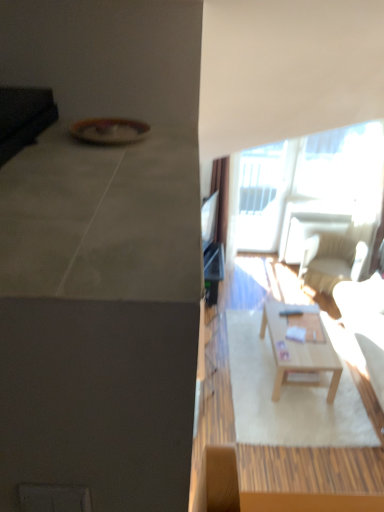
Question: Is matte black tv at upper right wider or thinner than white leather couch at right?

Choices:
 (A) wide
 (B) thin

Answer: (B)

Question: Considering their positions, is matte black tv at upper right located in front of or behind white leather couch at right?

Choices:
 (A) behind
 (B) front

Answer: (A)

Question: Estimate the real-world distances between objects in this image. Which object is farther from the light brown wooden coffee table at center?

Choices:
 (A) matte black tv at upper right
 (B) transparent glass window at upper right
 (C) light beige fabric chair at right
 (D) white leather couch at right

Answer: (B)

Question: Which object is positioned closest to the white leather couch at right?

Choices:
 (A) light beige fabric chair at right
 (B) transparent glass window at upper right
 (C) light brown wooden coffee table at center
 (D) matte black tv at upper right

Answer: (C)